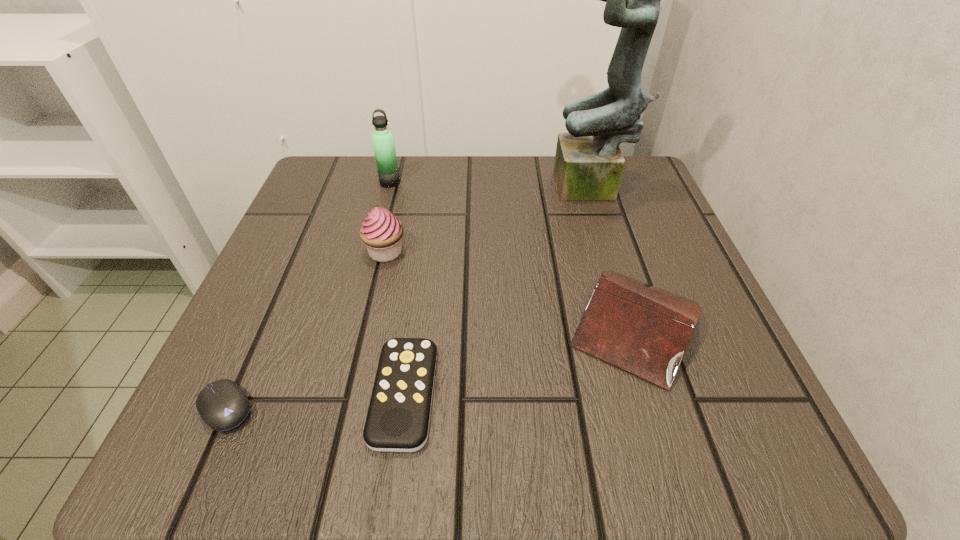
At what (x,y) coordinates should I click in order to perform the action: click on computer mouse present at the left edge. Please return your answer as a coordinate pair (x, y). This screenshot has height=540, width=960. Looking at the image, I should click on (223, 405).

Image resolution: width=960 pixels, height=540 pixels. In order to click on sculpture that is at the right edge in this screenshot , I will do `click(589, 164)`.

Where is `book positioned at the right edge`? The image size is (960, 540). book positioned at the right edge is located at coordinates (645, 330).

You are a GUI agent. You are given a task and a screenshot of the screen. Output one action in this format:
    pyautogui.click(x=<x>, y=<y>)
    Task: Click on the object located in the far left corner section of the desktop
    
    Given the screenshot: What is the action you would take?
    pyautogui.click(x=383, y=141)

Where is `object present at the near left corner`? The width and height of the screenshot is (960, 540). object present at the near left corner is located at coordinates (223, 405).

The image size is (960, 540). What are the coordinates of `object at the far right corner` in the screenshot? It's located at (589, 164).

What are the coordinates of `vacant space at the far edge of the desktop` in the screenshot? It's located at (461, 177).

Identify the location of vacant space at the near edge. (324, 410).

The image size is (960, 540). Identify the location of vacant space at the left edge of the desktop. (346, 293).

Locate an element on the screen. The width and height of the screenshot is (960, 540). vacant space at the right edge of the desktop is located at coordinates (654, 226).